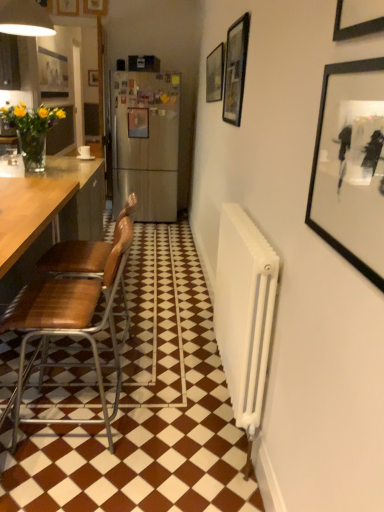
You are a GUI agent. You are given a task and a screenshot of the screen. Output one action in this format:
    pyautogui.click(x=<x>, y=<y>)
    Task: Click on the free location in front of brown leather chair at left, placed as the 1th chair when sorted from front to back
    
    Given the screenshot: What is the action you would take?
    pyautogui.click(x=72, y=480)